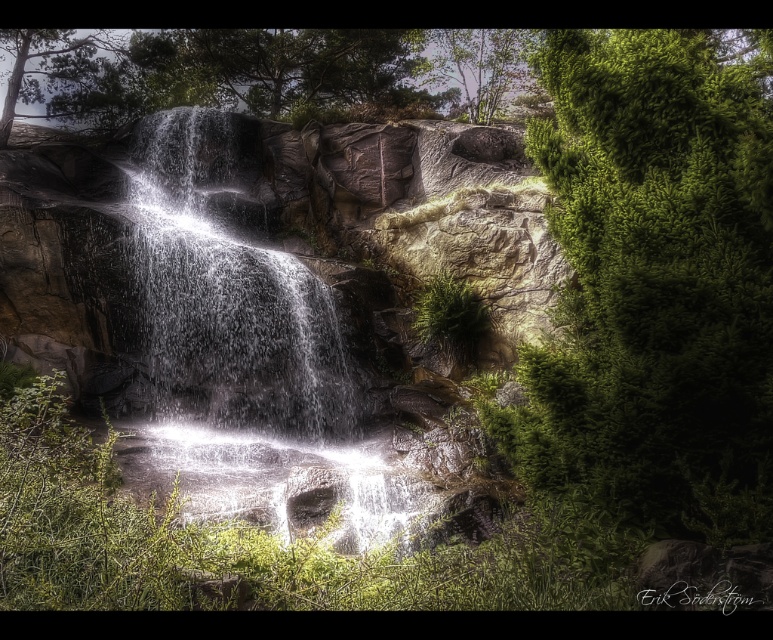
Which is more to the left, clear water at center or green matte tree at upper left?

Positioned to the left is green matte tree at upper left.

Image resolution: width=773 pixels, height=640 pixels. Find the location of `clear water at center`. clear water at center is located at coordinates (227, 292).

In order to click on clear water at center in this screenshot , I will do `click(227, 292)`.

Who is positioned more to the right, green textured bush at right or clear water at center?

green textured bush at right is more to the right.

Identify the location of green textured bush at right. This screenshot has height=640, width=773. (654, 285).

Between point (627, 381) and point (53, 88), which one is positioned in front?

Point (627, 381) is in front.

Can you confirm if green textured bush at right is thinner than green matte tree at upper left?

Correct, green textured bush at right's width is less than green matte tree at upper left's.

The height and width of the screenshot is (640, 773). Describe the element at coordinates (654, 285) in the screenshot. I see `green textured bush at right` at that location.

At what (x,y) coordinates should I click in order to perform the action: click on green textured bush at right. Please return your answer as a coordinate pair (x, y). The image size is (773, 640). Looking at the image, I should click on (654, 285).